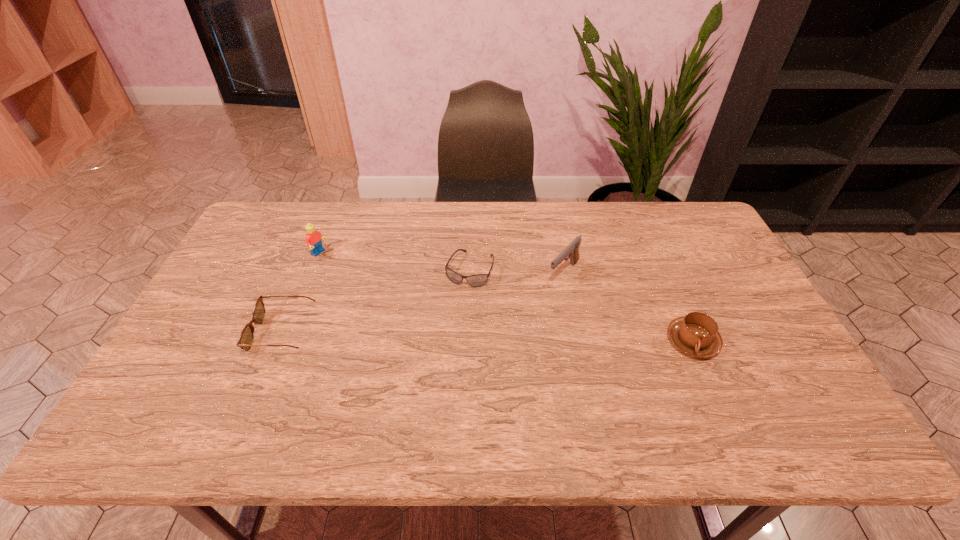
The image size is (960, 540). Identify the location of vacant space located 0.200m at the barrel of the fourth object from left to right. (516, 326).

The height and width of the screenshot is (540, 960). Identify the location of vacant space located on the lenses of the third object from right to left. (449, 326).

Where is `vacant position located on the lenses of the third object from right to left`? The image size is (960, 540). vacant position located on the lenses of the third object from right to left is located at coordinates (443, 343).

Where is `vacant space situated 0.370m on the lenses of the third object from right to left`? The width and height of the screenshot is (960, 540). vacant space situated 0.370m on the lenses of the third object from right to left is located at coordinates (421, 395).

At what (x,y) coordinates should I click in order to perform the action: click on free space located on the face of the Lego. Please return your answer as a coordinate pair (x, y). This screenshot has width=960, height=540. Looking at the image, I should click on (346, 267).

The height and width of the screenshot is (540, 960). Identify the location of vacant space located 0.080m on the face of the Lego. (344, 266).

Find the location of `free space located 0.070m on the face of the Lego`. free space located 0.070m on the face of the Lego is located at coordinates (342, 265).

This screenshot has height=540, width=960. Find the location of `object present at the right edge`. object present at the right edge is located at coordinates (696, 334).

The width and height of the screenshot is (960, 540). In order to click on free space at the far edge in this screenshot , I will do `click(424, 240)`.

Image resolution: width=960 pixels, height=540 pixels. I want to click on vacant area at the near edge, so click(x=533, y=397).